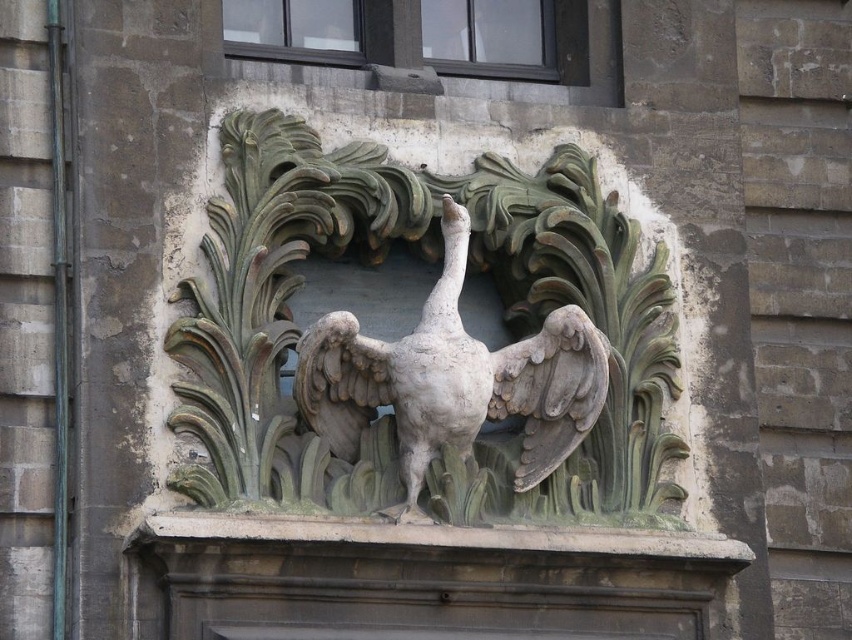
Can you confirm if matte stone bird at center is positioned to the left of gray stone bird at center?

Yes, matte stone bird at center is to the left of gray stone bird at center.

In order to click on matte stone bird at center in this screenshot , I will do `click(426, 342)`.